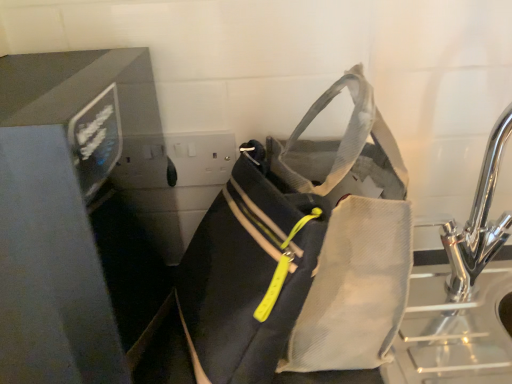
Question: From a real-world perspective, is matte black monitor at left physically above chrome metallic sink at right?

Choices:
 (A) no
 (B) yes

Answer: (B)

Question: Is matte black monitor at left oriented away from chrome metallic sink at right?

Choices:
 (A) yes
 (B) no

Answer: (B)

Question: Is matte black monitor at left further to camera compared to chrome metallic sink at right?

Choices:
 (A) yes
 (B) no

Answer: (B)

Question: From the image's perspective, is matte black monitor at left under chrome metallic sink at right?

Choices:
 (A) no
 (B) yes

Answer: (B)

Question: From a real-world perspective, does matte black monitor at left sit lower than chrome metallic sink at right?

Choices:
 (A) no
 (B) yes

Answer: (A)

Question: Is matte black monitor at left in front of or behind matte black bag at center in the image?

Choices:
 (A) behind
 (B) front

Answer: (B)

Question: Is matte black monitor at left to the left or to the right of matte black bag at center in the image?

Choices:
 (A) right
 (B) left

Answer: (B)

Question: Is matte black monitor at left wider or thinner than matte black bag at center?

Choices:
 (A) wide
 (B) thin

Answer: (A)

Question: Is point (27, 190) positioned closer to the camera than point (223, 322)?

Choices:
 (A) closer
 (B) farther

Answer: (B)

Question: Is matte black bag at center inside or outside of chrome metallic sink at right?

Choices:
 (A) outside
 (B) inside

Answer: (A)

Question: In terms of height, does matte black bag at center look taller or shorter compared to chrome metallic sink at right?

Choices:
 (A) tall
 (B) short

Answer: (B)

Question: From the image's perspective, is matte black bag at center positioned above or below chrome metallic sink at right?

Choices:
 (A) below
 (B) above

Answer: (A)

Question: In terms of size, does matte black bag at center appear bigger or smaller than chrome metallic sink at right?

Choices:
 (A) big
 (B) small

Answer: (A)

Question: Considering the relative positions of matte black bag at center and matte black monitor at left in the image provided, is matte black bag at center to the left or to the right of matte black monitor at left?

Choices:
 (A) left
 (B) right

Answer: (B)

Question: Is point pos(256,180) closer or farther from the camera than point pos(14,225)?

Choices:
 (A) farther
 (B) closer

Answer: (B)